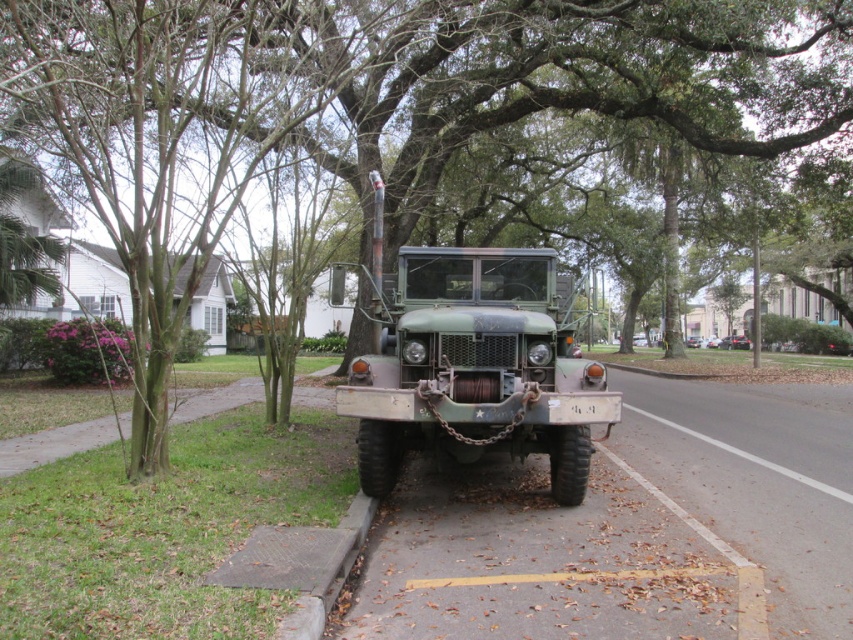
Looking at this image, can you confirm if green matte truck at center is shorter than matte green truck at center?

Incorrect, green matte truck at center's height does not fall short of matte green truck at center's.

Which is behind, point (399, 378) or point (733, 337)?

The point (733, 337) is more distant.

Is point (442, 417) positioned after point (737, 344)?

No, (442, 417) is closer to viewer.

Locate an element on the screen. This screenshot has height=640, width=853. green matte truck at center is located at coordinates (474, 369).